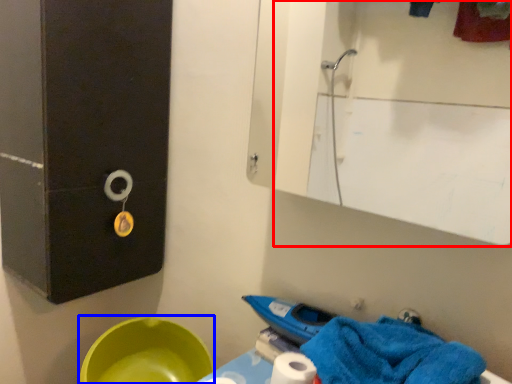
Question: Which object is further to the camera taking this photo, mirror (highlighted by a red box) or basin (highlighted by a blue box)?

Choices:
 (A) mirror
 (B) basin

Answer: (B)